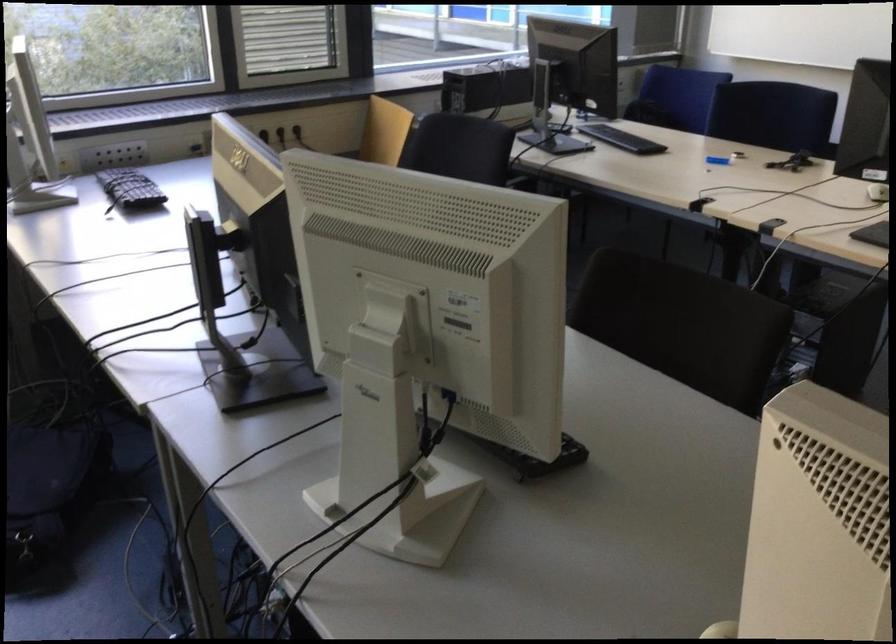
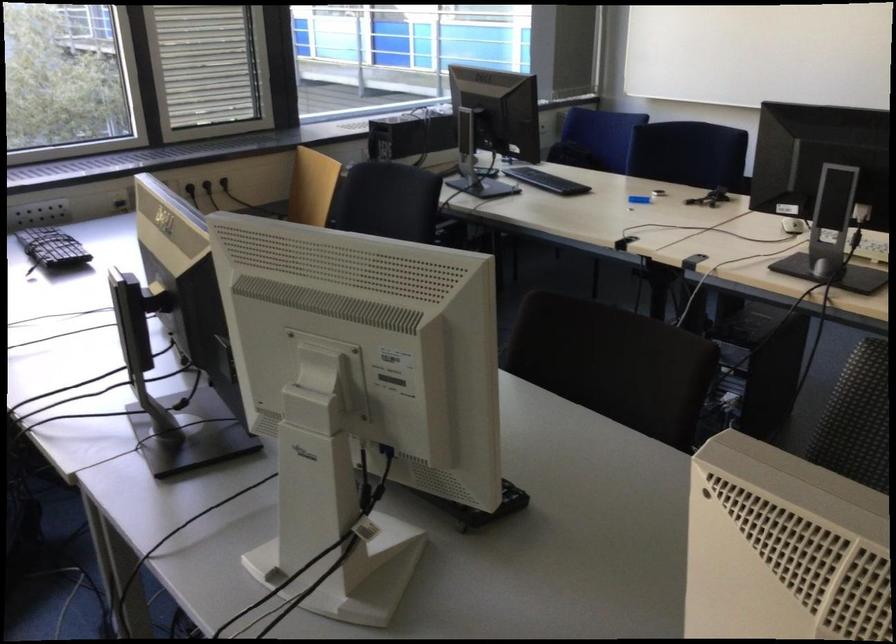
The point at (461, 154) is marked in the first image. Where is the corresponding point in the second image?

(391, 201)